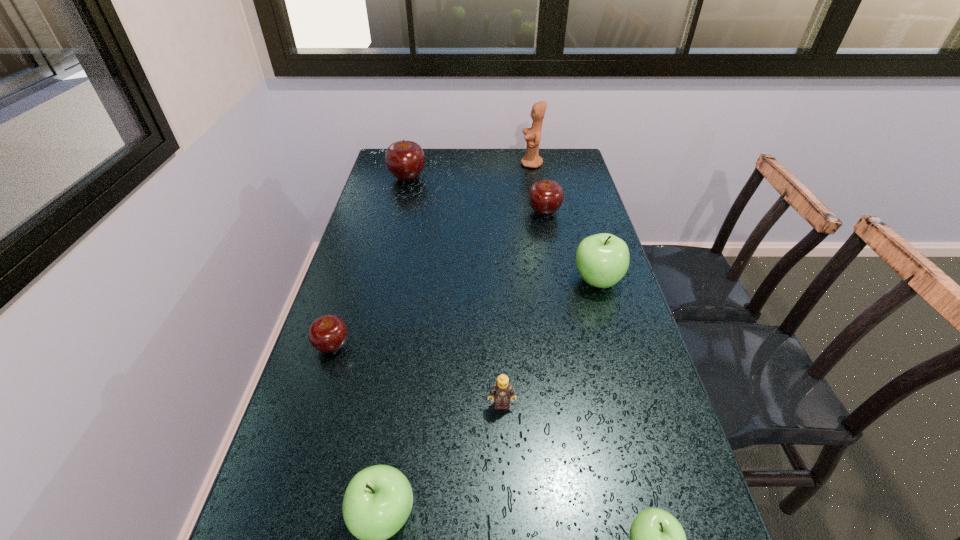
At what (x,y) coordinates should I click in order to perform the action: click on the tallest object. Please return your answer as a coordinate pair (x, y). Looking at the image, I should click on (531, 159).

This screenshot has height=540, width=960. What are the coordinates of `the farthest red apple` in the screenshot? It's located at 405,160.

You are a GUI agent. You are given a task and a screenshot of the screen. Output one action in this format:
    pyautogui.click(x=<x>, y=<y>)
    Task: Click on the biggest red apple
    
    Given the screenshot: What is the action you would take?
    pyautogui.click(x=405, y=160)

Image resolution: width=960 pixels, height=540 pixels. Find the location of `the fifth nearest object`. the fifth nearest object is located at coordinates (602, 260).

This screenshot has width=960, height=540. I want to click on the third farthest apple, so click(x=602, y=260).

The height and width of the screenshot is (540, 960). In order to click on the rightmost red apple in this screenshot , I will do `click(545, 197)`.

Identify the location of the second biggest red apple. (545, 197).

Find the location of `the fourth object from left to right`. the fourth object from left to right is located at coordinates (502, 391).

At what (x,y) coordinates should I click in order to perform the action: click on tan Lego. Please return your answer as a coordinate pair (x, y). The width and height of the screenshot is (960, 540). Looking at the image, I should click on (502, 391).

Identify the location of the fifth farthest object. The height and width of the screenshot is (540, 960). (x=328, y=333).